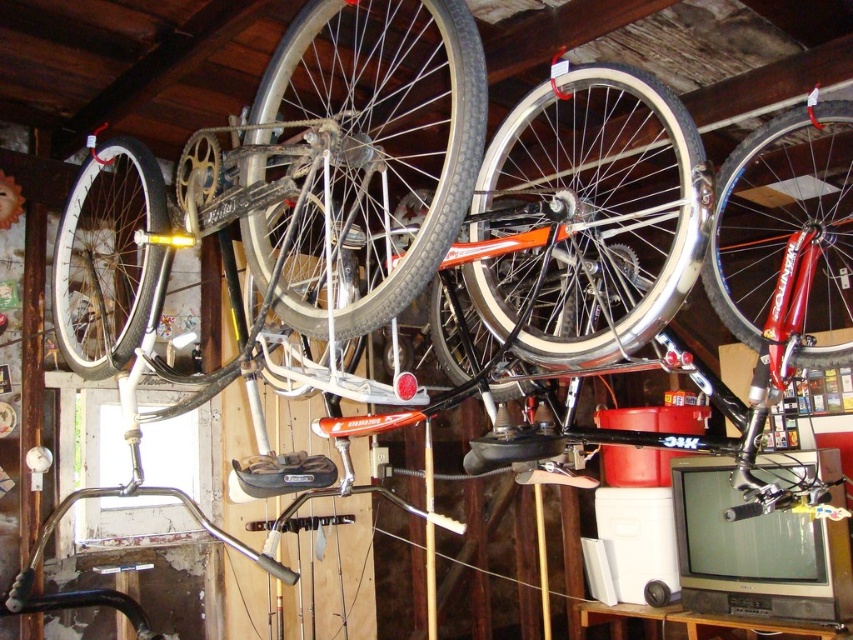
Can you confirm if white rubber tire at center is positioned below shiny silver rim at left?

Incorrect, white rubber tire at center is not positioned below shiny silver rim at left.

This screenshot has height=640, width=853. What do you see at coordinates (595, 216) in the screenshot? I see `white rubber tire at center` at bounding box center [595, 216].

Identify the location of white rubber tire at center. Image resolution: width=853 pixels, height=640 pixels. (595, 216).

Is shiny silver bicycle wheel at upper center to the right of shiny silver rim at left from the viewer's perspective?

Indeed, shiny silver bicycle wheel at upper center is positioned on the right side of shiny silver rim at left.

Consider the image. Does shiny silver bicycle wheel at upper center appear on the left side of shiny silver rim at left?

In fact, shiny silver bicycle wheel at upper center is to the right of shiny silver rim at left.

Who is more distant from viewer, (381, 188) or (114, 284)?

Positioned behind is point (114, 284).

I want to click on shiny silver bicycle wheel at upper center, so click(375, 150).

Is shiny red bicycle wheel at upper right shorter than shiny silver rim at left?

In fact, shiny red bicycle wheel at upper right may be taller than shiny silver rim at left.

This screenshot has height=640, width=853. What do you see at coordinates (787, 232) in the screenshot?
I see `shiny red bicycle wheel at upper right` at bounding box center [787, 232].

Who is more forward, (741, 186) or (141, 209)?

Point (141, 209) is in front.

Locate an element on the screen. This screenshot has width=853, height=640. shiny red bicycle wheel at upper right is located at coordinates (787, 232).